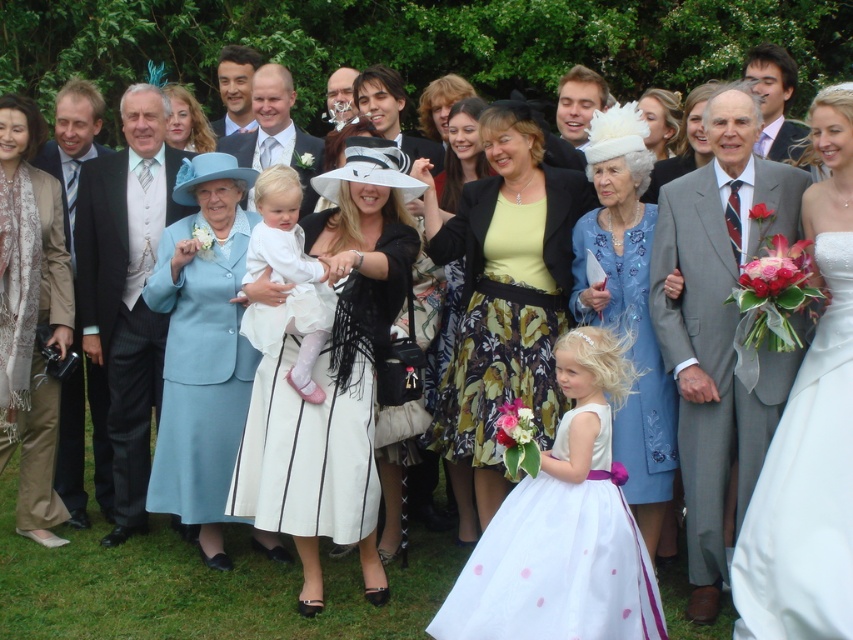
You are a photographer at this wedding and need to position the bride in the white satin dress at right and the guest in the light blue fabric dress at left for a group photo. Based on their current positions, which dress is lower in the frame?

The white satin dress at right is located below the light blue fabric dress at left, so the white satin dress at right is lower in the frame.

You are a photographer at a wedding, and you need to capture a photo of both the white satin dress at center and the matte blue dress at center. Based on their positions, which dress will appear more prominent in the photo?

The white satin dress at center will appear more prominent in the photo because it is positioned in front of the matte blue dress at center, making it closer to the camera and thus more visible.

You are a photographer at a wedding, and you need to capture a group photo of the guests. You are standing at the front of the group, which is 3 meters wide. The white satin dress at center and the matte blue dress at center are part of the group. Can you fit both dresses in the frame if your camera has a 3.5 meter wide field of view?

The distance between the white satin dress at center and matte blue dress at center is 4.34 meters. Since your camera can only capture 3.5 meters, the two dresses are too far apart to fit within the frame.